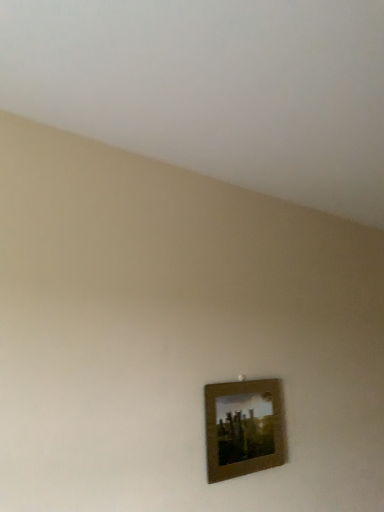
Measure the distance between wooden picture frame at lower center and camera.

They are 4.18 feet apart.

The width and height of the screenshot is (384, 512). What do you see at coordinates (244, 428) in the screenshot? I see `wooden picture frame at lower center` at bounding box center [244, 428].

At what (x,y) coordinates should I click in order to perform the action: click on wooden picture frame at lower center. Please return your answer as a coordinate pair (x, y). This screenshot has width=384, height=512. Looking at the image, I should click on (244, 428).

Identify the location of wooden picture frame at lower center. (244, 428).